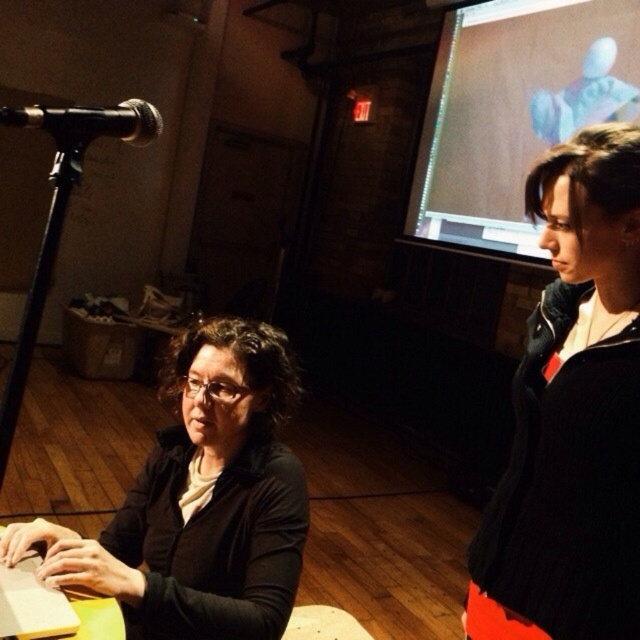
You are organizing a clothing display and need to arrange the black knit sweater at upper right and the matte black sweater at lower left on a rack. Based on their sizes, which one should be placed higher on the rack?

The black knit sweater at upper right should be placed higher on the rack since it is much taller than the matte black sweater at lower left.

You are organizing a virtual meeting and need to ensure both participants can see each other clearly. The meeting platform allows you to choose between the matte brown screen at upper right and the wooden laptop at lower left as the primary display. Based on their positions, which device should you select to show the speaker more prominently?

The matte brown screen at upper right should be selected because it is positioned on the right side of the wooden laptop at lower left, which is where the seated individual with the microphone is located. This placement would center the speaker within the frame for better visibility.